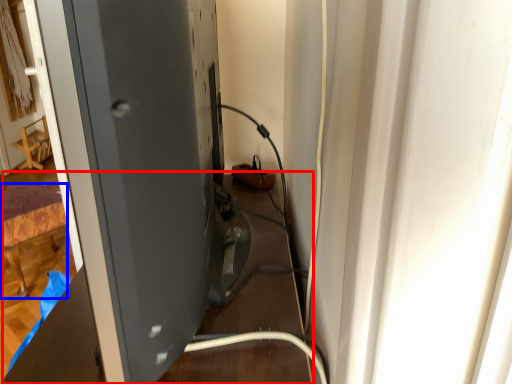
Question: Which of the following is the closest to the observer, table (highlighted by a red box) or furniture (highlighted by a blue box)?

Choices:
 (A) table
 (B) furniture

Answer: (A)